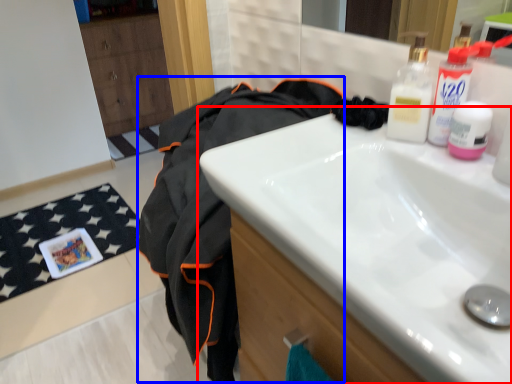
Question: Which object appears closest to the camera in this image, sink (highlighted by a red box) or clothing (highlighted by a blue box)?

Choices:
 (A) sink
 (B) clothing

Answer: (A)